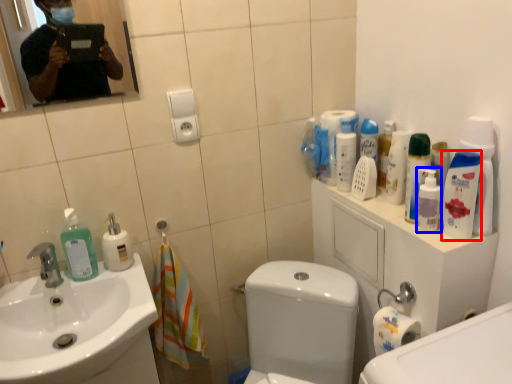
Question: Which object is closer to the camera taking this photo, mouthwash (highlighted by a red box) or cleaning product (highlighted by a blue box)?

Choices:
 (A) mouthwash
 (B) cleaning product

Answer: (A)